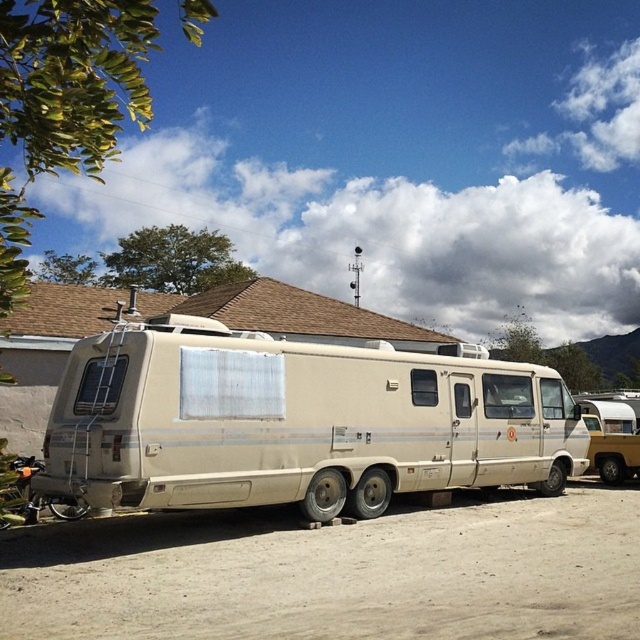
Question: Does beige matte van at center appear under dirt sand at lower center?

Choices:
 (A) yes
 (B) no

Answer: (B)

Question: Which point appears farthest from the camera in this image?

Choices:
 (A) (97, 339)
 (B) (125, 625)

Answer: (A)

Question: Can you confirm if beige matte van at center is positioned to the left of dirt sand at lower center?

Choices:
 (A) no
 (B) yes

Answer: (B)

Question: Which of the following is the farthest from the observer?

Choices:
 (A) dirt sand at lower center
 (B) beige matte van at center

Answer: (B)

Question: Which point appears closest to the camera in this image?

Choices:
 (A) (182, 330)
 (B) (508, 547)

Answer: (B)

Question: Is beige matte van at center to the right of dirt sand at lower center from the viewer's perspective?

Choices:
 (A) yes
 (B) no

Answer: (B)